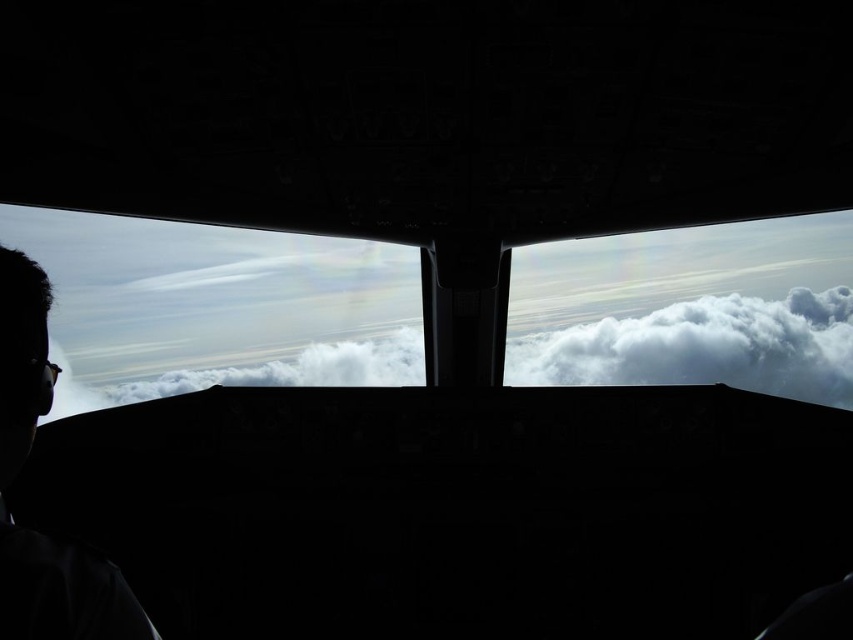
You are a passenger in the aircraft and want to know if the white fluffy cloud at center outside the cockpit window is larger than the silhouette head at left of the pilot. Can you confirm this based on the view from your seat?

The white fluffy cloud at center is bigger than silhouette head at left, so yes, the cloud is larger than the pilot silhouette.

You are a passenger sitting in the aircraft cockpit and looking out through the front windshield. You see the white fluffy cloud at center and the silhouette head at left. Which object is positioned lower in your field of view?

The white fluffy cloud at center is located below the silhouette head at left, so it is positioned lower in your field of view.

You are a passenger seated in the aircraft and want to take a photo of the rainbow clouds outside through the transparent glass airplane window at center. Your camera requires the subject to be at least 36 inches away to focus properly. Can you take the photo without moving closer to the window?

The transparent glass airplane window at center is 35.64 inches from the camera, which is less than the required 36 inches. Therefore, you cannot take the photo without moving closer to the window to meet the distance requirement.